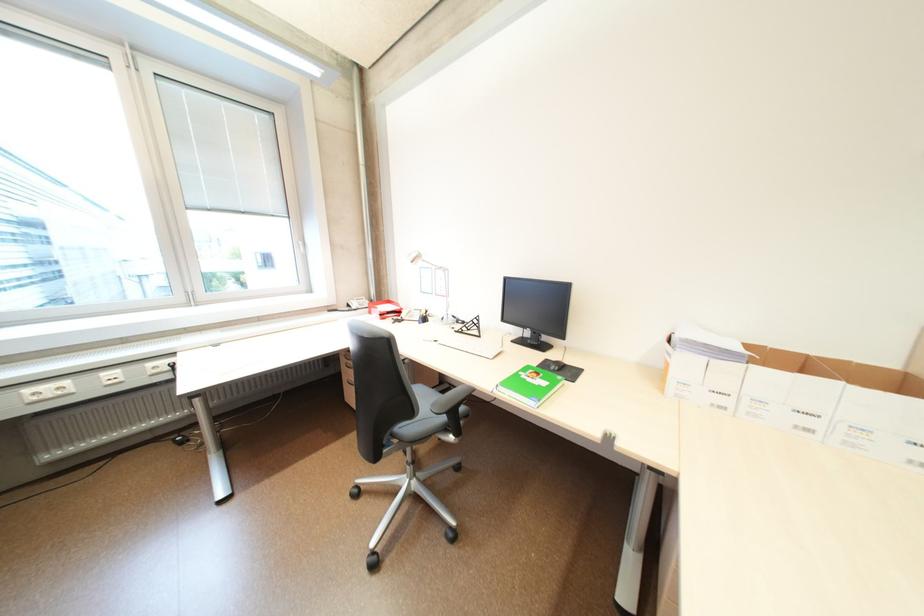
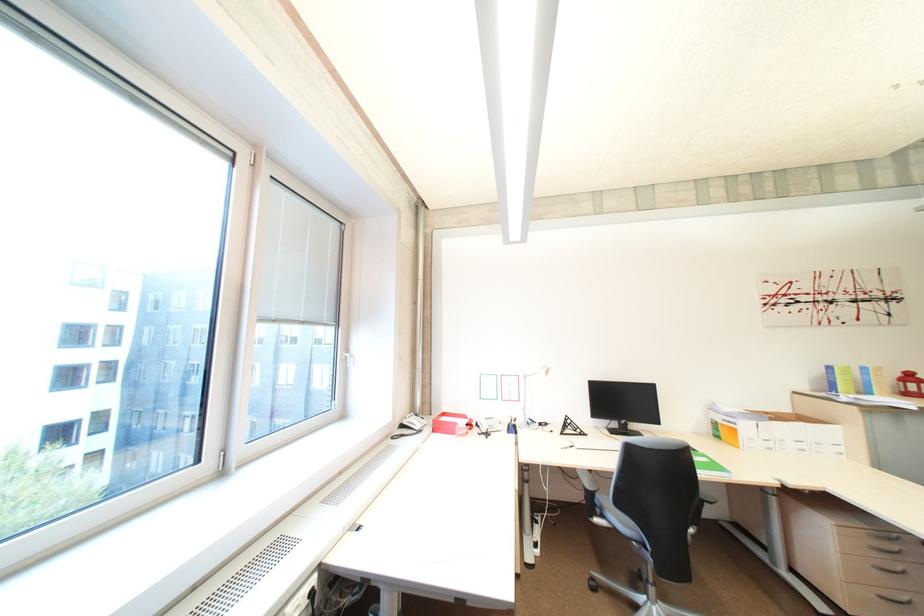
Question: I am providing you with two images of the same scene from different viewpoints. Please identify which objects are invisible in image2.

Choices:
 (A) green notebook
 (B) red telephone handset
 (C) red lantern object
 (D) none of these

Answer: (D)